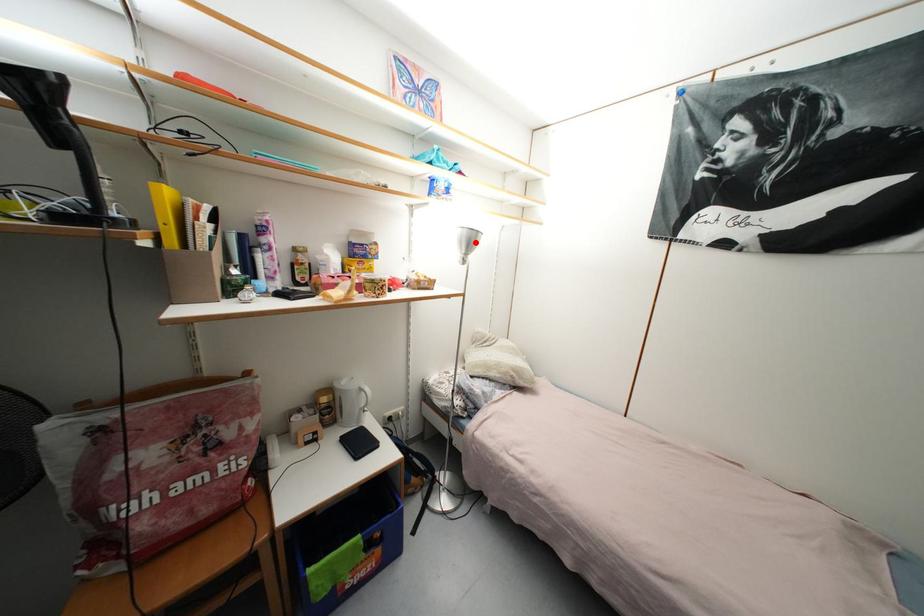
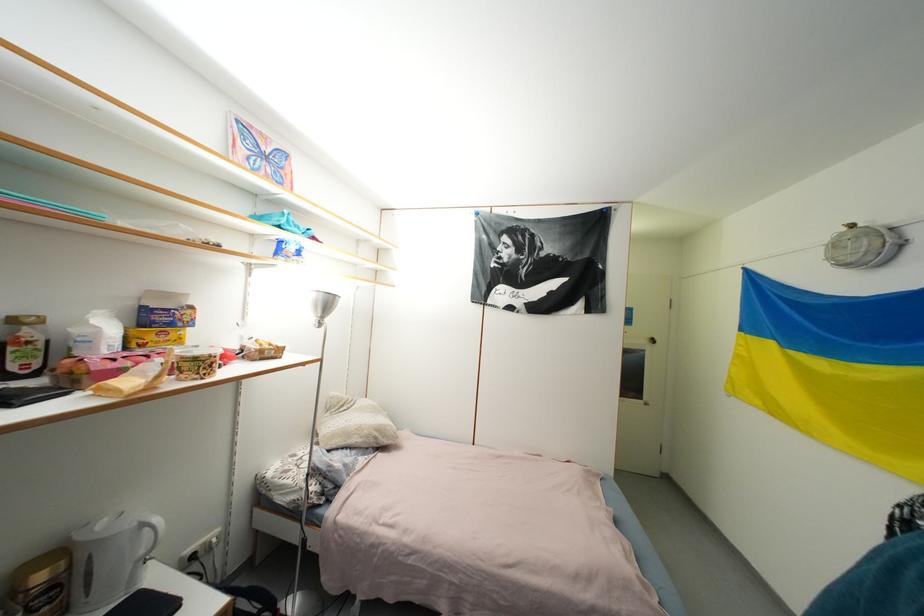
In the second image, find the point that corresponds to the highlighted location in the first image.

(333, 306)